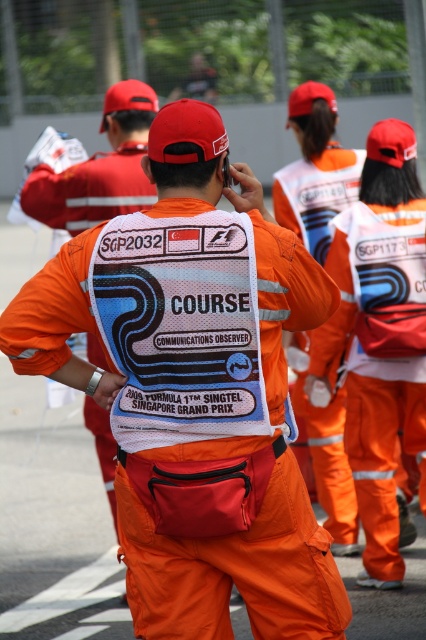
Question: Does orange fabric uniform at center lie in front of orange fabric vest at center?

Choices:
 (A) yes
 (B) no

Answer: (A)

Question: Which object is the closest to the orange reflective vest at center?

Choices:
 (A) orange fabric vest at center
 (B) orange reflective uniform at center
 (C) orange fabric uniform at center

Answer: (B)

Question: Is orange fabric uniform at center closer to the viewer compared to orange reflective vest at center?

Choices:
 (A) yes
 (B) no

Answer: (A)

Question: Which object is closer to the camera taking this photo?

Choices:
 (A) orange reflective uniform at center
 (B) orange fabric vest at center

Answer: (A)

Question: Which is nearer to the orange reflective vest at center?

Choices:
 (A) orange fabric vest at center
 (B) orange reflective uniform at center
 (C) orange fabric uniform at center

Answer: (B)

Question: Does orange reflective uniform at center have a smaller size compared to orange reflective vest at center?

Choices:
 (A) yes
 (B) no

Answer: (B)